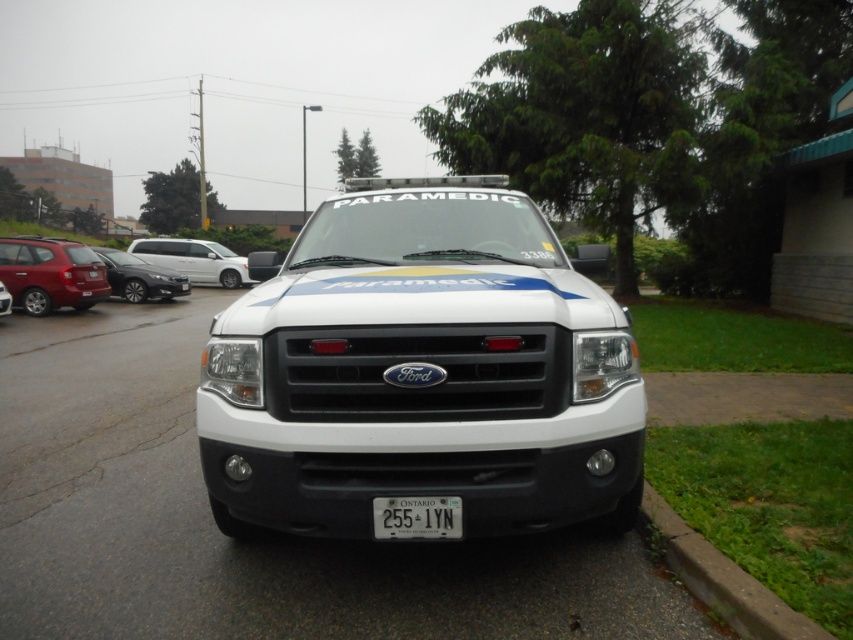
Does white glossy paramedic vehicle at center have a lesser width compared to green grass at lower right?

No, white glossy paramedic vehicle at center is not thinner than green grass at lower right.

Based on the photo, between white glossy paramedic vehicle at center and green grass at lower right, which one has less height?

Standing shorter between the two is green grass at lower right.

Between point (256, 326) and point (683, 524), which one is positioned behind?

The point (683, 524) is more distant.

Where is `white glossy paramedic vehicle at center`? The image size is (853, 640). white glossy paramedic vehicle at center is located at coordinates (421, 371).

Based on the photo, who is lower down, white glossy paramedic vehicle at center or white plastic license plate at center?

white plastic license plate at center is below.

Does white glossy paramedic vehicle at center have a greater width compared to white plastic license plate at center?

Indeed, white glossy paramedic vehicle at center has a greater width compared to white plastic license plate at center.

The width and height of the screenshot is (853, 640). Find the location of `white glossy paramedic vehicle at center`. white glossy paramedic vehicle at center is located at coordinates (421, 371).

Find the location of `white glossy paramedic vehicle at center`. white glossy paramedic vehicle at center is located at coordinates (421, 371).

Is white glossy paramedic vehicle at center further to the viewer compared to white glossy minivan at center?

No, it is not.

Is white glossy paramedic vehicle at center smaller than white glossy minivan at center?

Correct, white glossy paramedic vehicle at center occupies less space than white glossy minivan at center.

Describe the element at coordinates (421, 371) in the screenshot. The width and height of the screenshot is (853, 640). I see `white glossy paramedic vehicle at center` at that location.

Locate an element on the screen. The width and height of the screenshot is (853, 640). white glossy paramedic vehicle at center is located at coordinates (421, 371).